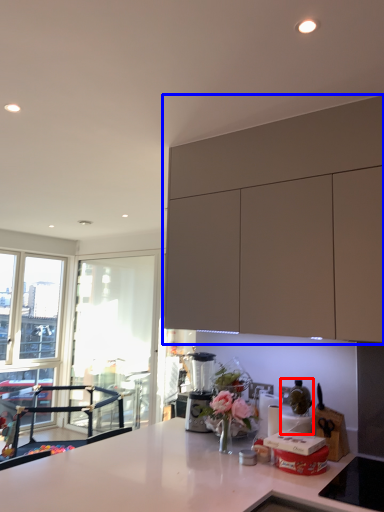
Question: Which object appears farthest to the camera in this image, appliance (highlighted by a red box) or cabinetry (highlighted by a blue box)?

Choices:
 (A) appliance
 (B) cabinetry

Answer: (A)